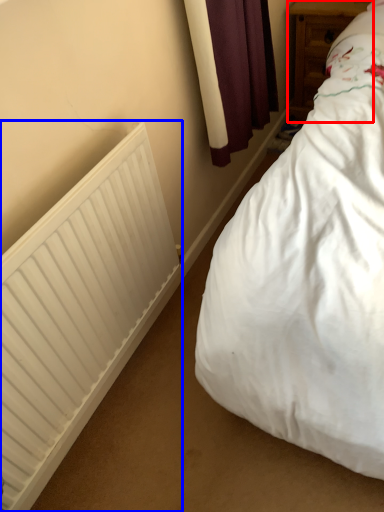
Question: Which of the following is the farthest to the observer, furniture (highlighted by a red box) or radiator (highlighted by a blue box)?

Choices:
 (A) furniture
 (B) radiator

Answer: (A)